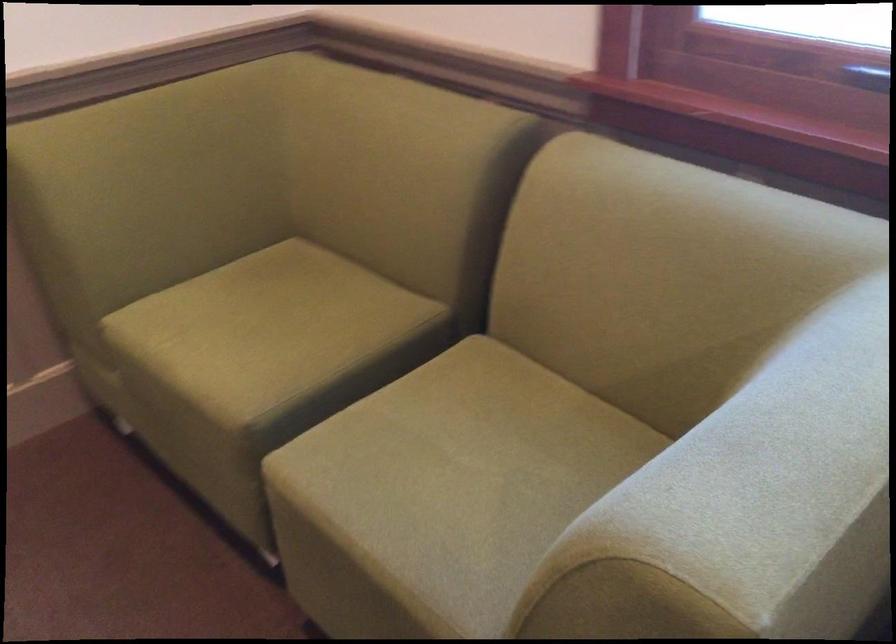
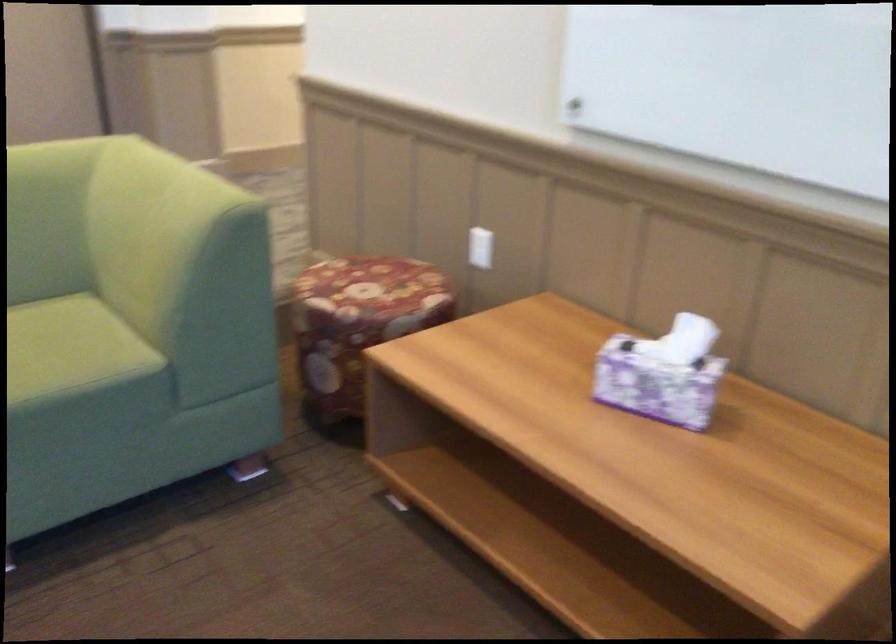
The images are taken continuously from a first-person perspective. In which direction is your viewpoint rotating?

The camera's rotation is toward left-down.